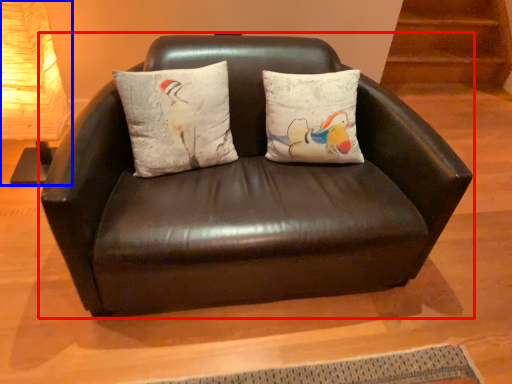
Question: Which point is closer to the camera, studio couch (highlighted by a red box) or table lamp (highlighted by a blue box)?

Choices:
 (A) studio couch
 (B) table lamp

Answer: (A)